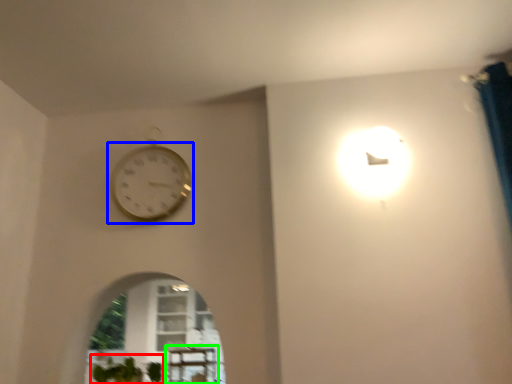
Question: Which object is the farthest from plant (highlighted by a red box)? Choose among these: wall clock (highlighted by a blue box) or table (highlighted by a green box).

Choices:
 (A) wall clock
 (B) table

Answer: (A)